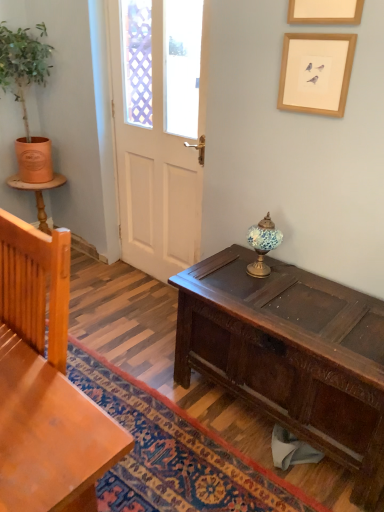
Question: Considering the relative sizes of white matte door at center and dark brown wood desk at center in the image provided, is white matte door at center wider than dark brown wood desk at center?

Choices:
 (A) yes
 (B) no

Answer: (B)

Question: Can you confirm if white matte door at center is thinner than dark brown wood desk at center?

Choices:
 (A) no
 (B) yes

Answer: (B)

Question: Is white matte door at center positioned beyond the bounds of dark brown wood desk at center?

Choices:
 (A) yes
 (B) no

Answer: (A)

Question: Could you tell me if white matte door at center is turned towards dark brown wood desk at center?

Choices:
 (A) yes
 (B) no

Answer: (B)

Question: Is white matte door at center oriented away from dark brown wood desk at center?

Choices:
 (A) yes
 (B) no

Answer: (B)

Question: From a real-world perspective, is white matte door at center physically below dark brown wood desk at center?

Choices:
 (A) yes
 (B) no

Answer: (B)

Question: From the image's perspective, is orange clay pot at left located beneath dark brown wood desk at center?

Choices:
 (A) yes
 (B) no

Answer: (B)

Question: Can you confirm if orange clay pot at left is wider than dark brown wood desk at center?

Choices:
 (A) yes
 (B) no

Answer: (B)

Question: Can we say orange clay pot at left lies outside dark brown wood desk at center?

Choices:
 (A) no
 (B) yes

Answer: (B)

Question: From a real-world perspective, is orange clay pot at left on top of dark brown wood desk at center?

Choices:
 (A) yes
 (B) no

Answer: (A)

Question: From the image's perspective, is orange clay pot at left over dark brown wood desk at center?

Choices:
 (A) no
 (B) yes

Answer: (B)

Question: From a real-world perspective, is orange clay pot at left below dark brown wood desk at center?

Choices:
 (A) no
 (B) yes

Answer: (A)

Question: From the image's perspective, is light brown wood chair at left under orange clay pot at left?

Choices:
 (A) yes
 (B) no

Answer: (A)